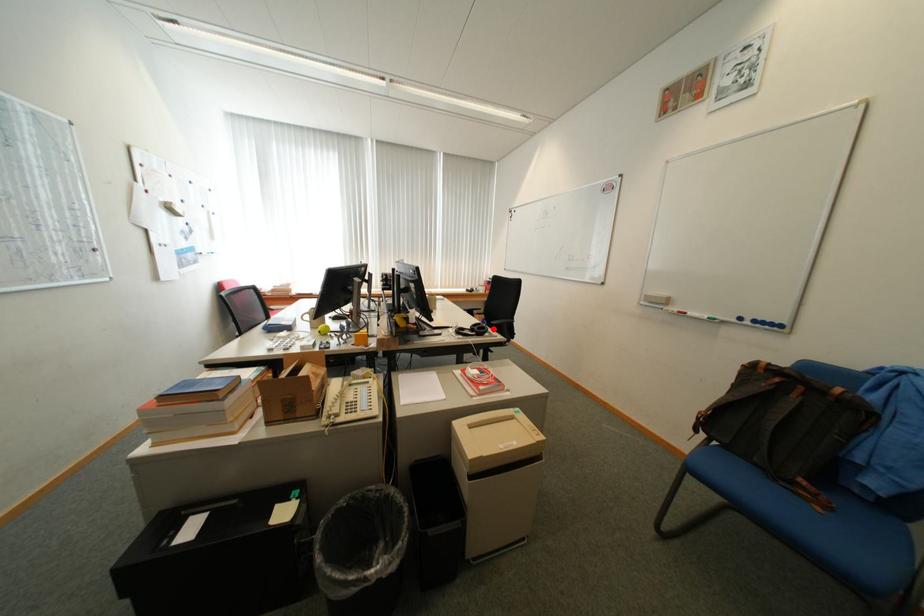
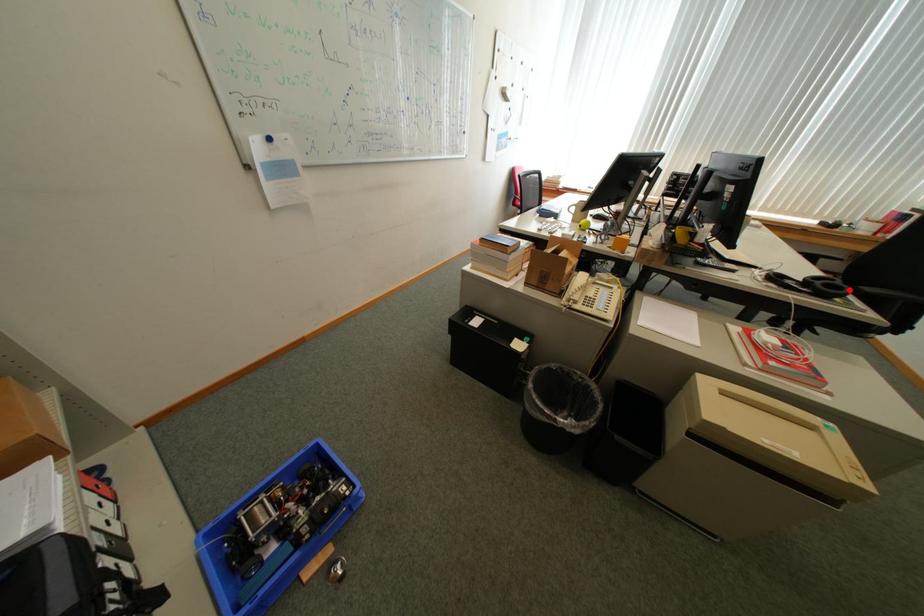
I am providing you with two images of the same scene from different viewpoints. A red point is marked on the first image and another point is marked on the second image. Does the point marked in image1 correspond to the same location as the one in image2?

Yes